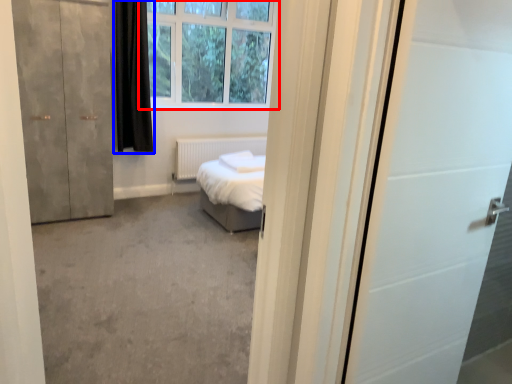
Question: Which point is closer to the camera, window (highlighted by a red box) or curtain (highlighted by a blue box)?

Choices:
 (A) window
 (B) curtain

Answer: (B)